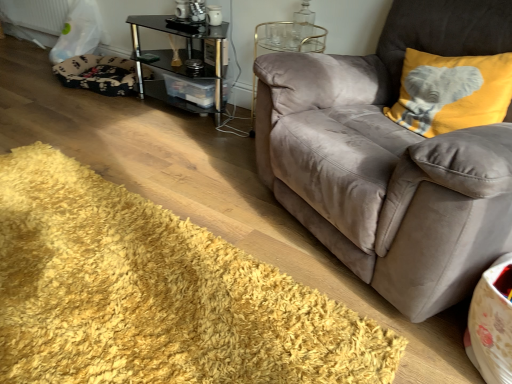
Find the location of `free space below yellow shaggy rug at lower left (from a real-world perspective)`. free space below yellow shaggy rug at lower left (from a real-world perspective) is located at coordinates (104, 260).